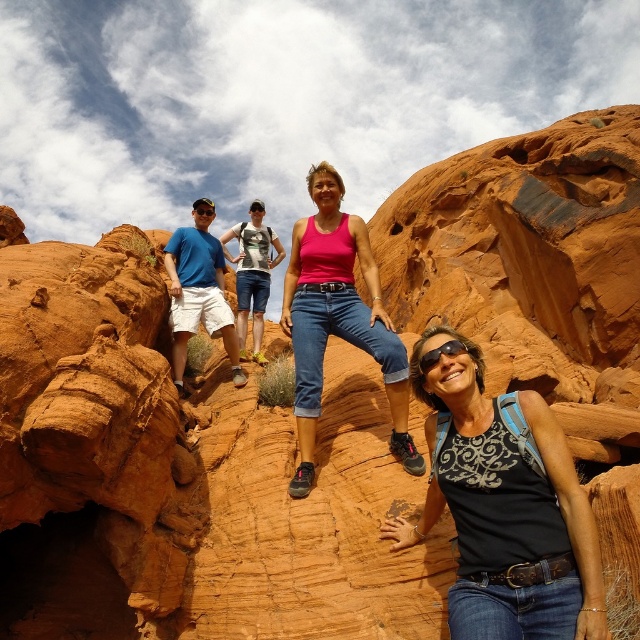
Question: Is matte blue t-shirt at left positioned before shiny orange goggles at center?

Choices:
 (A) yes
 (B) no

Answer: (A)

Question: Which point appears farthest from the camera in this image?

Choices:
 (A) (291, 278)
 (B) (582, 596)
 (C) (179, 333)
 (D) (209, 216)

Answer: (D)

Question: Is pink fabric tank top at center above shiny orange goggles at center?

Choices:
 (A) yes
 (B) no

Answer: (B)

Question: From the image, what is the correct spatial relationship of matte blue t-shirt at left in relation to shiny orange goggles at center?

Choices:
 (A) left
 (B) right

Answer: (B)

Question: Considering the real-world distances, which object is closest to the black matte tank top at center?

Choices:
 (A) pink fabric tank top at center
 (B) shiny orange goggles at center

Answer: (A)

Question: Considering the real-world distances, which object is farthest from the shiny orange goggles at center?

Choices:
 (A) black matte tank top at center
 (B) matte blue t-shirt at left
 (C) pink fabric tank top at center

Answer: (A)